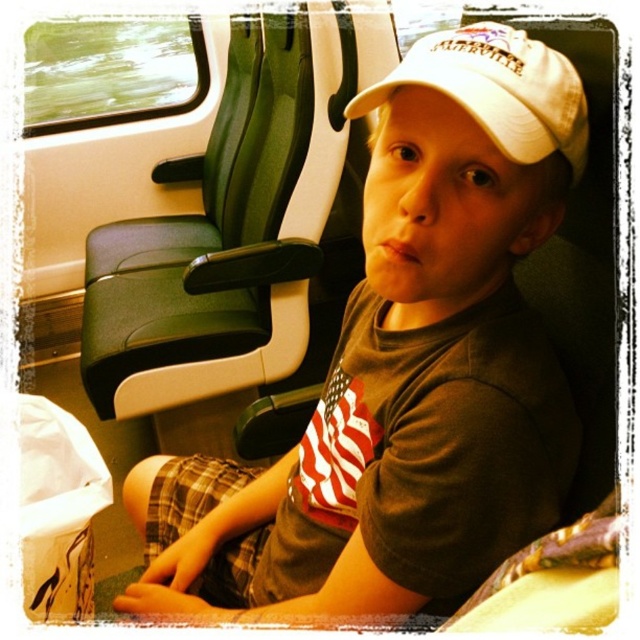
Question: Which point appears closest to the camera in this image?

Choices:
 (A) (372, 90)
 (B) (493, 100)

Answer: (B)

Question: Does white matte cap at upper center appear under white matte baseball cap at center?

Choices:
 (A) no
 (B) yes

Answer: (B)

Question: Can you confirm if white matte cap at upper center is thinner than white matte baseball cap at center?

Choices:
 (A) yes
 (B) no

Answer: (B)

Question: Does white matte cap at upper center have a greater width compared to white matte baseball cap at center?

Choices:
 (A) no
 (B) yes

Answer: (B)